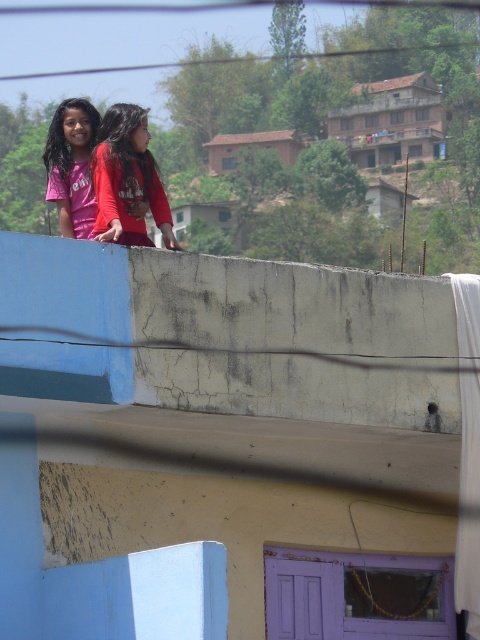
You are a photographer trying to capture both children in a single shot. Given that the matte red shirt at upper left and the pink matte shirt at upper left are both in the frame, which child should you focus on to ensure both are clearly visible in your photo?

You should focus on the pink matte shirt at upper left because it is wider than the matte red shirt at upper left, making it easier to capture both in the frame.

You are a photographer trying to capture a photo of the two children on the rooftop. You want to ensure that both the matte red shirt at upper left and the pink matte shirt at upper left are clearly visible in the frame. Given their heights, which child should you focus on first to ensure proper focus?

The matte red shirt at upper left is shorter than the pink matte shirt at upper left, so you should focus on the pink matte shirt at upper left first to ensure proper focus.